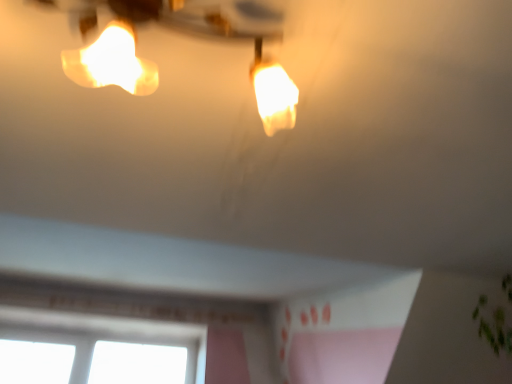
Question: Can we say matte white lamp at upper center lies outside transparent glass window at lower left?

Choices:
 (A) yes
 (B) no

Answer: (A)

Question: From the image's perspective, is matte white lamp at upper center located above transparent glass window at lower left?

Choices:
 (A) no
 (B) yes

Answer: (B)

Question: Is matte white lamp at upper center to the right of transparent glass window at lower left from the viewer's perspective?

Choices:
 (A) no
 (B) yes

Answer: (B)

Question: Can you confirm if matte white lamp at upper center is smaller than transparent glass window at lower left?

Choices:
 (A) no
 (B) yes

Answer: (B)

Question: From a real-world perspective, is matte white lamp at upper center physically above transparent glass window at lower left?

Choices:
 (A) no
 (B) yes

Answer: (A)

Question: Is matte white lamp at upper center positioned before transparent glass window at lower left?

Choices:
 (A) yes
 (B) no

Answer: (A)

Question: From a real-world perspective, is transparent glass window at lower left positioned over matte white lamp at upper center based on gravity?

Choices:
 (A) yes
 (B) no

Answer: (A)

Question: Is transparent glass window at lower left not inside matte white lamp at upper center?

Choices:
 (A) yes
 (B) no

Answer: (A)

Question: Is transparent glass window at lower left directly adjacent to matte white lamp at upper center?

Choices:
 (A) yes
 (B) no

Answer: (B)

Question: Is transparent glass window at lower left at the left side of matte white lamp at upper center?

Choices:
 (A) yes
 (B) no

Answer: (A)

Question: Can you confirm if transparent glass window at lower left is thinner than matte white lamp at upper center?

Choices:
 (A) no
 (B) yes

Answer: (B)

Question: Does transparent glass window at lower left appear on the right side of matte white lamp at upper center?

Choices:
 (A) yes
 (B) no

Answer: (B)

Question: Is transparent glass window at lower left inside the boundaries of matte white lamp at upper center, or outside?

Choices:
 (A) outside
 (B) inside

Answer: (A)